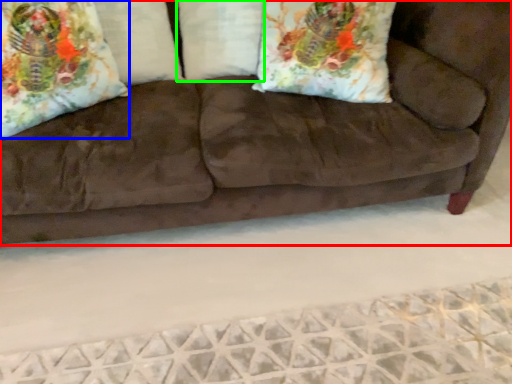
Question: Based on their relative distances, which object is farther from studio couch (highlighted by a red box)? Choose from throw pillow (highlighted by a blue box) and pillow (highlighted by a green box).

Choices:
 (A) throw pillow
 (B) pillow

Answer: (A)